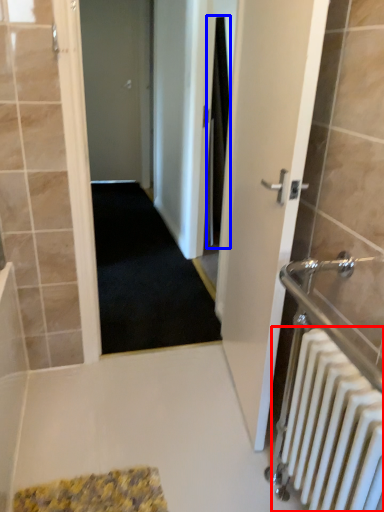
Question: Which object appears farthest to the camera in this image, radiator (highlighted by a red box) or shower curtain (highlighted by a blue box)?

Choices:
 (A) radiator
 (B) shower curtain

Answer: (B)